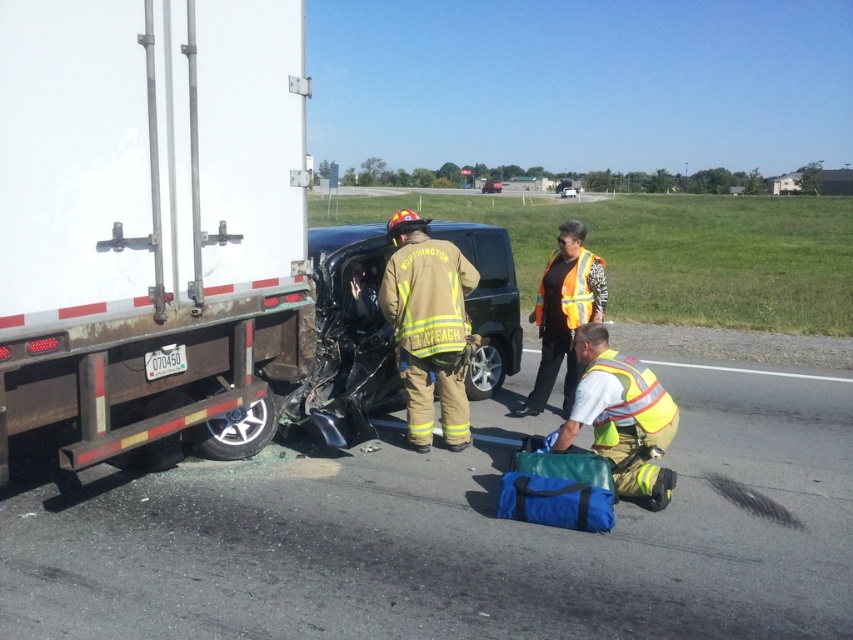
Where is `white matte truck at left`? The height and width of the screenshot is (640, 853). white matte truck at left is located at coordinates (151, 221).

The image size is (853, 640). In order to click on white matte truck at left in this screenshot , I will do `click(151, 221)`.

Who is more forward, (x=553, y=266) or (x=483, y=182)?

Point (x=553, y=266) is more forward.

Can you confirm if orange reflective vest at center is positioned below black glossy car at center?

Indeed, orange reflective vest at center is positioned under black glossy car at center.

Is point (577, 250) positioned after point (485, 186)?

No.

This screenshot has width=853, height=640. In order to click on orange reflective vest at center in this screenshot , I will do `click(564, 314)`.

Does point (374, 339) lie behind point (549, 260)?

That is False.

Can you confirm if black matte car at center is positioned above orange reflective vest at center?

Yes, black matte car at center is above orange reflective vest at center.

Does point (320, 332) come in front of point (599, 282)?

Yes.

Where is `black matte car at center`? black matte car at center is located at coordinates (346, 339).